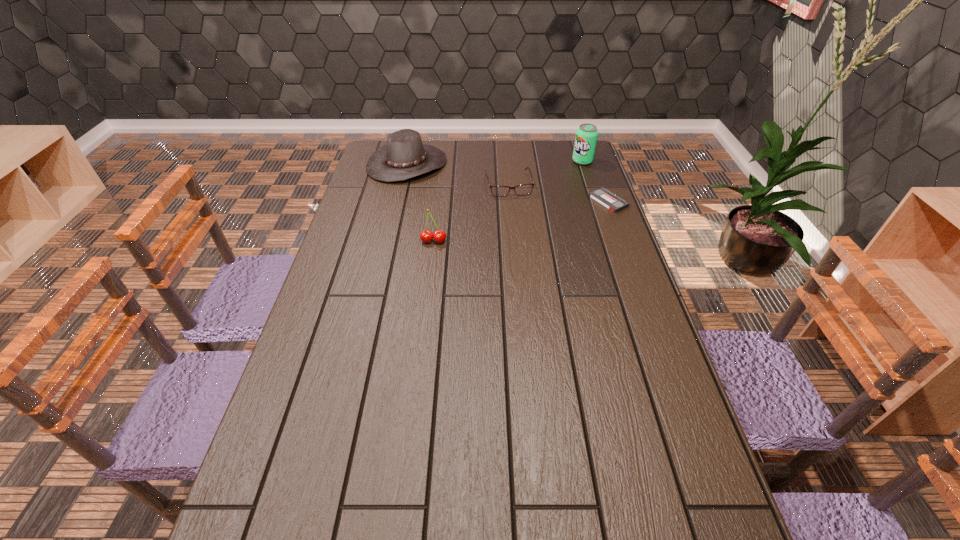
At what (x,y) coordinates should I click in order to perform the action: click on vacant area that lies between the spectacles and the shortest object. Please return your answer as a coordinate pair (x, y). Looking at the image, I should click on (559, 193).

Find the location of a particular element. The height and width of the screenshot is (540, 960). free space between the hat and the tallest object is located at coordinates (494, 163).

Locate an element on the screen. The image size is (960, 540). free area in between the pop soda and the hat is located at coordinates (494, 163).

At what (x,y) coordinates should I click in order to perform the action: click on unoccupied area between the tallest object and the hat. Please return your answer as a coordinate pair (x, y). This screenshot has width=960, height=540. Looking at the image, I should click on (494, 163).

Identify the location of empty location between the hat and the pop soda. (494, 163).

Where is `vacant space that's between the third object from right to left and the nearest object`? The image size is (960, 540). vacant space that's between the third object from right to left and the nearest object is located at coordinates (471, 213).

The height and width of the screenshot is (540, 960). In order to click on blank region between the hat and the fourth tallest object in this screenshot , I will do `click(458, 174)`.

Identify the location of empty location between the shortest object and the cherry. (521, 221).

Identify which object is located as the nearest to the pop soda. Please provide its 2D coordinates. Your answer should be formatted as a tuple, i.e. [(x, y)], where the tuple contains the x and y coordinates of a point satisfying the conditions above.

[(614, 203)]

The width and height of the screenshot is (960, 540). I want to click on object that is the third closest to the hat, so click(x=586, y=135).